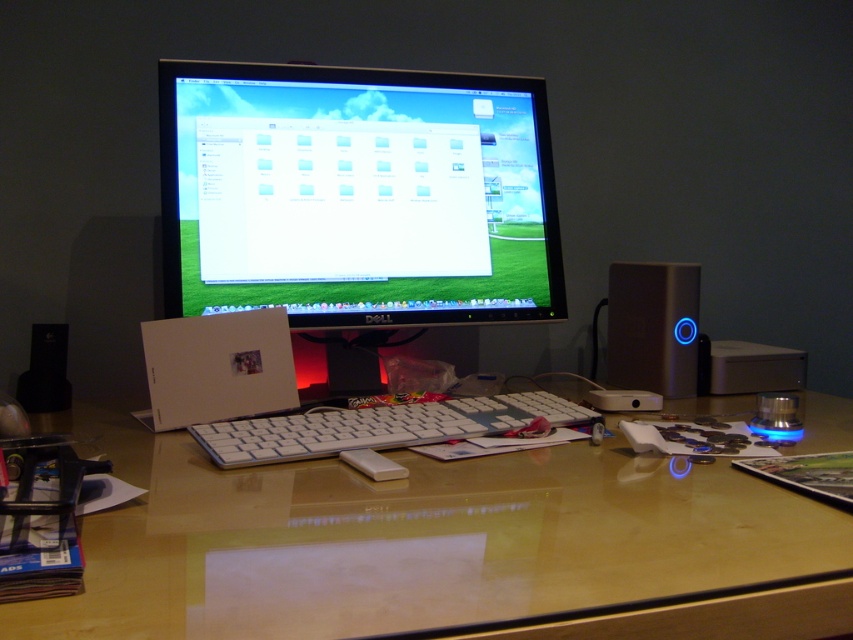
You are a delivery person who just arrived at the office. You need to place a package on the glossy wood computer desk at center. The package has a sticker with coordinates point (447,548). Where should you place the package on the desk?

The point (447,548) corresponds to the glossy wood computer desk at center, so you should place the package at that specific coordinate on the desk.

You are looking at the workspace setup and want to place a small sticker exactly halfway between the two points, point [190,614] and point [242,433]. Considering their positions, will the sticker be closer to the monitor or the edge of the desk?

The sticker placed halfway between point [190,614] and point [242,433] will be closer to the edge of the desk because point [190,614] is closer to the viewer than point [242,433], so the midpoint leans towards the viewer, away from the monitor.